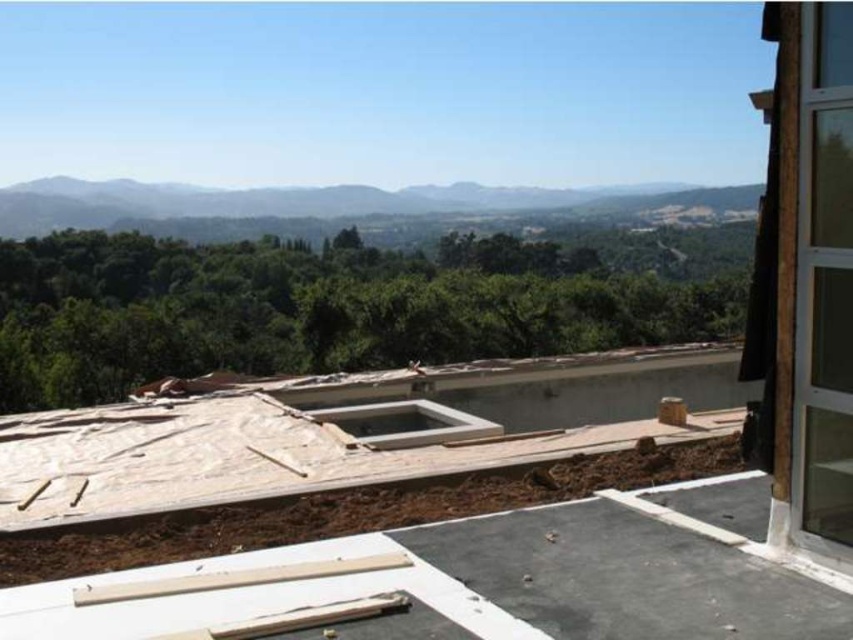
Which is more to the left, smooth concrete roof at center or wooden boards at center?

From the viewer's perspective, wooden boards at center appears more on the left side.

Looking at this image, who is lower down, smooth concrete roof at center or wooden boards at center?

smooth concrete roof at center

Who is more forward, (381, 545) or (209, 460)?

Point (381, 545)

Identify the location of smooth concrete roof at center. (505, 579).